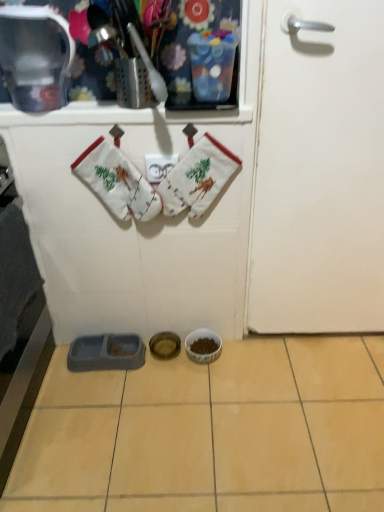
Question: Is white cotton oven mitts at upper center, positioned as the first baby clothe in left-to-right order, positioned before metallic silver container at upper left?

Choices:
 (A) yes
 (B) no

Answer: (B)

Question: Can you confirm if white cotton oven mitts at upper center, marked as the second baby clothe in a right-to-left arrangement, is shorter than metallic silver container at upper left?

Choices:
 (A) yes
 (B) no

Answer: (B)

Question: Is white cotton oven mitts at upper center, positioned as the first baby clothe in left-to-right order, at the left side of metallic silver container at upper left?

Choices:
 (A) no
 (B) yes

Answer: (A)

Question: Can you confirm if white cotton oven mitts at upper center, marked as the second baby clothe in a right-to-left arrangement, is bigger than metallic silver container at upper left?

Choices:
 (A) yes
 (B) no

Answer: (B)

Question: Is white cotton oven mitts at upper center, positioned as the first baby clothe in left-to-right order, further to the viewer compared to metallic silver container at upper left?

Choices:
 (A) yes
 (B) no

Answer: (A)

Question: Choose the correct answer: Is white matte door at right inside metallic silver container at upper left or outside it?

Choices:
 (A) outside
 (B) inside

Answer: (A)

Question: Does point (301, 47) appear closer or farther from the camera than point (6, 51)?

Choices:
 (A) closer
 (B) farther

Answer: (A)

Question: From a real-world perspective, is white matte door at right physically located above or below metallic silver container at upper left?

Choices:
 (A) above
 (B) below

Answer: (B)

Question: Visually, is white matte door at right positioned to the left or to the right of metallic silver container at upper left?

Choices:
 (A) left
 (B) right

Answer: (B)

Question: Considering their positions, is white cotton oven mitts at center, acting as the 1th baby clothe starting from the right, located in front of or behind metallic silver container at upper left?

Choices:
 (A) front
 (B) behind

Answer: (B)

Question: Is white cotton oven mitts at center, the second baby clothe from the left, bigger or smaller than metallic silver container at upper left?

Choices:
 (A) big
 (B) small

Answer: (A)

Question: From the image's perspective, is white cotton oven mitts at center, acting as the 1th baby clothe starting from the right, located above or below metallic silver container at upper left?

Choices:
 (A) above
 (B) below

Answer: (B)

Question: Does point [208, 136] appear closer or farther from the camera than point [44, 34]?

Choices:
 (A) closer
 (B) farther

Answer: (B)

Question: Is white cotton oven mitts at upper center, marked as the second baby clothe in a right-to-left arrangement, bigger or smaller than white cotton oven mitts at center, acting as the 1th baby clothe starting from the right?

Choices:
 (A) small
 (B) big

Answer: (A)

Question: Is point tap(115, 177) positioned closer to the camera than point tap(190, 184)?

Choices:
 (A) farther
 (B) closer

Answer: (A)